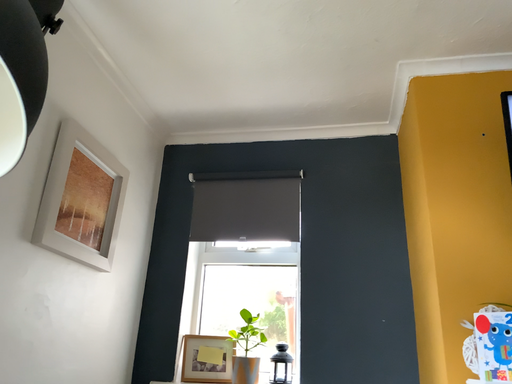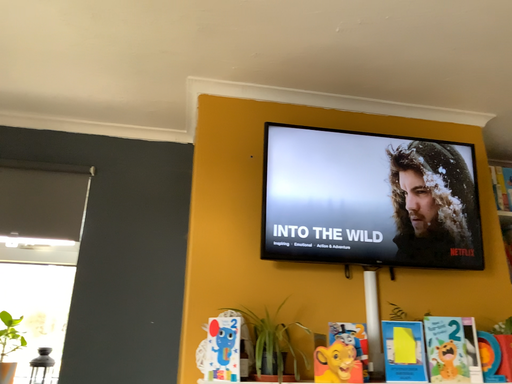
Question: How did the camera likely rotate when shooting the video?

Choices:
 (A) rotated right
 (B) rotated left

Answer: (A)